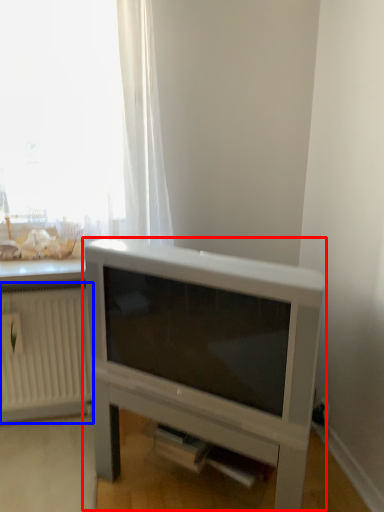
Question: Among these objects, which one is farthest to the camera, entertainment center (highlighted by a red box) or radiator (highlighted by a blue box)?

Choices:
 (A) entertainment center
 (B) radiator

Answer: (B)